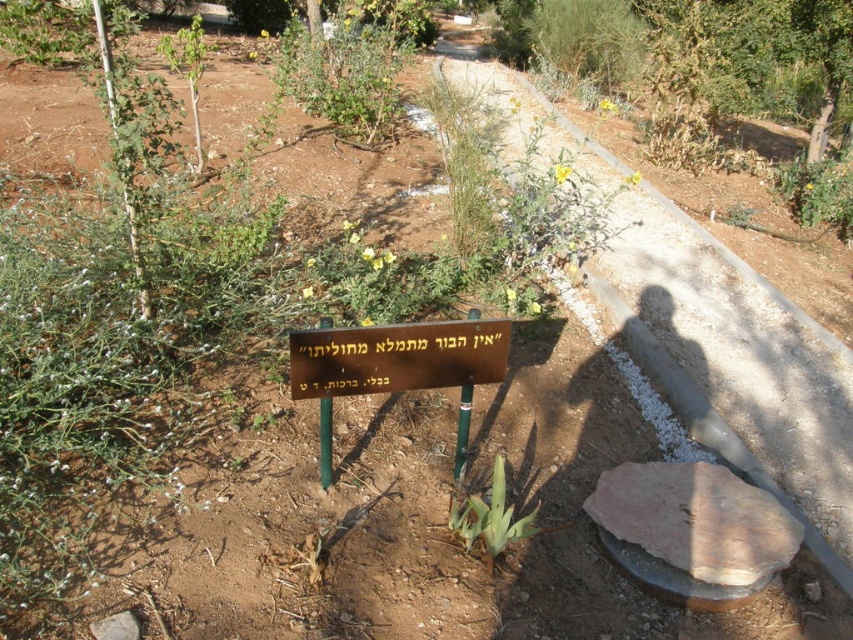
Question: Is brown rough stone at lower right thinner than green leafy plant at center?

Choices:
 (A) no
 (B) yes

Answer: (A)

Question: Which object is the farthest from the brown rough stone at lower right?

Choices:
 (A) bronze metallic sign at center
 (B) yellow-green leafy plant at center
 (C) brown polished sign at center

Answer: (B)

Question: Among these points, which one is farthest from the camera?

Choices:
 (A) (811, 211)
 (B) (532, 529)
 (C) (738, 548)

Answer: (A)

Question: Where is green leafy plant at upper right located in relation to green leafy plant at center in the image?

Choices:
 (A) below
 (B) above

Answer: (B)

Question: Can you confirm if brown polished sign at center is bigger than green leafy plant at upper right?

Choices:
 (A) yes
 (B) no

Answer: (B)

Question: Estimate the real-world distances between objects in this image. Which object is farther from the brown polished sign at center?

Choices:
 (A) green leafy plant at upper right
 (B) brown rough stone at lower right
 (C) yellow-green leafy plant at center

Answer: (A)